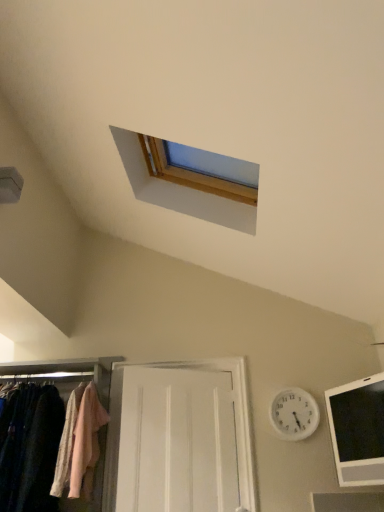
Question: Are white plastic clock at upper center and light pink fabric at left beside each other?

Choices:
 (A) no
 (B) yes

Answer: (A)

Question: Does white plastic clock at upper center have a larger size compared to light pink fabric at left?

Choices:
 (A) no
 (B) yes

Answer: (A)

Question: Can you confirm if white plastic clock at upper center is positioned to the right of light pink fabric at left?

Choices:
 (A) yes
 (B) no

Answer: (A)

Question: From the image's perspective, does white plastic clock at upper center appear higher than light pink fabric at left?

Choices:
 (A) no
 (B) yes

Answer: (B)

Question: Can you confirm if white plastic clock at upper center is wider than light pink fabric at left?

Choices:
 (A) no
 (B) yes

Answer: (A)

Question: From a real-world perspective, is white plastic clock at upper center on top of light pink fabric at left?

Choices:
 (A) yes
 (B) no

Answer: (A)

Question: Can you confirm if white wooden door at center is bigger than matte fabric closet at lower left?

Choices:
 (A) yes
 (B) no

Answer: (B)

Question: Considering the relative sizes of white wooden door at center and matte fabric closet at lower left in the image provided, is white wooden door at center smaller than matte fabric closet at lower left?

Choices:
 (A) yes
 (B) no

Answer: (A)

Question: From a real-world perspective, is white wooden door at center positioned under matte fabric closet at lower left based on gravity?

Choices:
 (A) yes
 (B) no

Answer: (B)

Question: From the image's perspective, is white wooden door at center below matte fabric closet at lower left?

Choices:
 (A) no
 (B) yes

Answer: (B)

Question: Is the position of white wooden door at center less distant than that of matte fabric closet at lower left?

Choices:
 (A) no
 (B) yes

Answer: (A)

Question: From a real-world perspective, does white wooden door at center stand above matte fabric closet at lower left?

Choices:
 (A) yes
 (B) no

Answer: (A)

Question: Is matte fabric closet at lower left shorter than white wooden door at center?

Choices:
 (A) no
 (B) yes

Answer: (B)